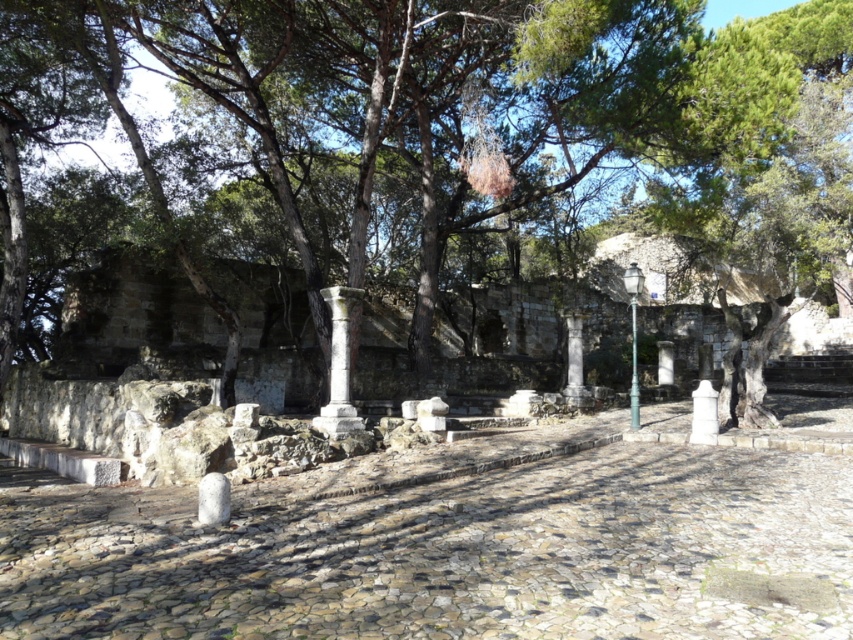
You are standing at the camera position and want to walk to both points in the image. Which point, point (340, 433) or point (714, 392), will you reach first?

Point (340, 433) is closer to the camera than point (714, 392), so you will reach point (340, 433) first.